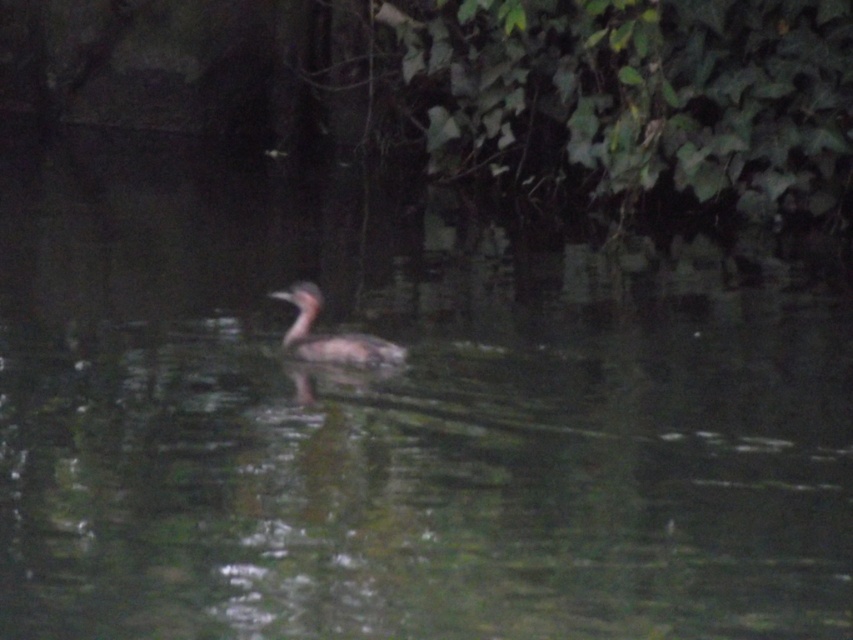
You are a photographer trying to capture the brown speckled duck at center and the green leafy vegetation at upper right in a single shot. Which object will appear bigger in the photo?

The green leafy vegetation at upper right will appear bigger in the photo because it is larger in size than the brown speckled duck at center.

You are an ornithologist observing the brown speckled duck at center and the green leafy vegetation at upper right. Which object is taller?

The green leafy vegetation at upper right is taller than the brown speckled duck at center.